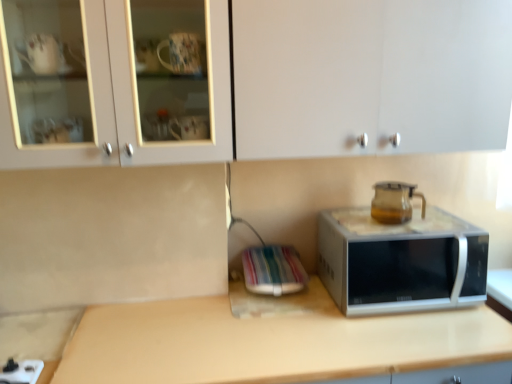
Question: Would you consider beige laminate countertop at center to be distant from silver metallic microwave at center?

Choices:
 (A) yes
 (B) no

Answer: (B)

Question: Can we say beige laminate countertop at center lies outside silver metallic microwave at center?

Choices:
 (A) no
 (B) yes

Answer: (B)

Question: Is beige laminate countertop at center in front of silver metallic microwave at center?

Choices:
 (A) yes
 (B) no

Answer: (A)

Question: Could you tell me if beige laminate countertop at center is turned towards silver metallic microwave at center?

Choices:
 (A) yes
 (B) no

Answer: (B)

Question: From the image's perspective, is beige laminate countertop at center located above silver metallic microwave at center?

Choices:
 (A) no
 (B) yes

Answer: (A)

Question: From the image's perspective, is white glossy cabinet at upper center positioned above or below transparent glass coffeepot at upper right?

Choices:
 (A) below
 (B) above

Answer: (B)

Question: Considering the positions of white glossy cabinet at upper center and transparent glass coffeepot at upper right in the image, is white glossy cabinet at upper center taller or shorter than transparent glass coffeepot at upper right?

Choices:
 (A) tall
 (B) short

Answer: (A)

Question: Choose the correct answer: Is white glossy cabinet at upper center inside transparent glass coffeepot at upper right or outside it?

Choices:
 (A) inside
 (B) outside

Answer: (B)

Question: Is point (x=156, y=150) positioned closer to the camera than point (x=388, y=210)?

Choices:
 (A) closer
 (B) farther

Answer: (A)

Question: From the image's perspective, relative to beige laminate countertop at center, is transparent glass coffeepot at upper right above or below?

Choices:
 (A) below
 (B) above

Answer: (B)

Question: Is transparent glass coffeepot at upper right in front of or behind beige laminate countertop at center in the image?

Choices:
 (A) front
 (B) behind

Answer: (B)

Question: In the image, is transparent glass coffeepot at upper right on the left side or the right side of beige laminate countertop at center?

Choices:
 (A) right
 (B) left

Answer: (A)

Question: Considering the positions of transparent glass coffeepot at upper right and beige laminate countertop at center in the image, is transparent glass coffeepot at upper right wider or thinner than beige laminate countertop at center?

Choices:
 (A) wide
 (B) thin

Answer: (B)

Question: Considering their positions, is beige laminate countertop at center located in front of or behind white glossy cabinet at upper center?

Choices:
 (A) front
 (B) behind

Answer: (B)

Question: Does point (130, 309) appear closer or farther from the camera than point (152, 117)?

Choices:
 (A) closer
 (B) farther

Answer: (B)